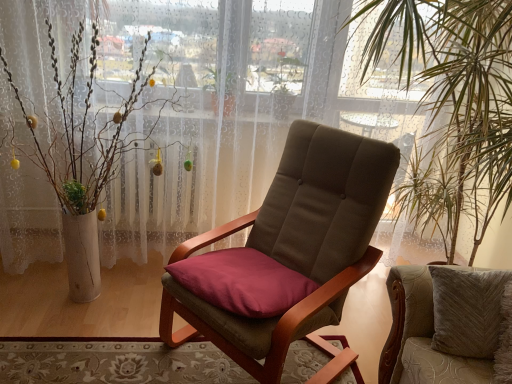
Question: Is point (456, 177) closer or farther from the camera than point (231, 375)?

Choices:
 (A) farther
 (B) closer

Answer: (A)

Question: In terms of height, does green leafy plant at right look taller or shorter compared to carpeted rug at lower left?

Choices:
 (A) tall
 (B) short

Answer: (A)

Question: Which object is positioned farthest from the green leafy plant at right?

Choices:
 (A) white textured vase at left
 (B) carpeted rug at lower left
 (C) velvet beige cushion at center, positioned as the first chair in right-to-left order
 (D) brown fabric chair at center, which is the 2th chair in right-to-left order

Answer: (A)

Question: Based on their relative distances, which object is nearer to the velvet beige cushion at center, positioned as the first chair in right-to-left order?

Choices:
 (A) green leafy plant at right
 (B) white textured vase at left
 (C) brown fabric chair at center, which is the 2th chair in right-to-left order
 (D) carpeted rug at lower left

Answer: (C)